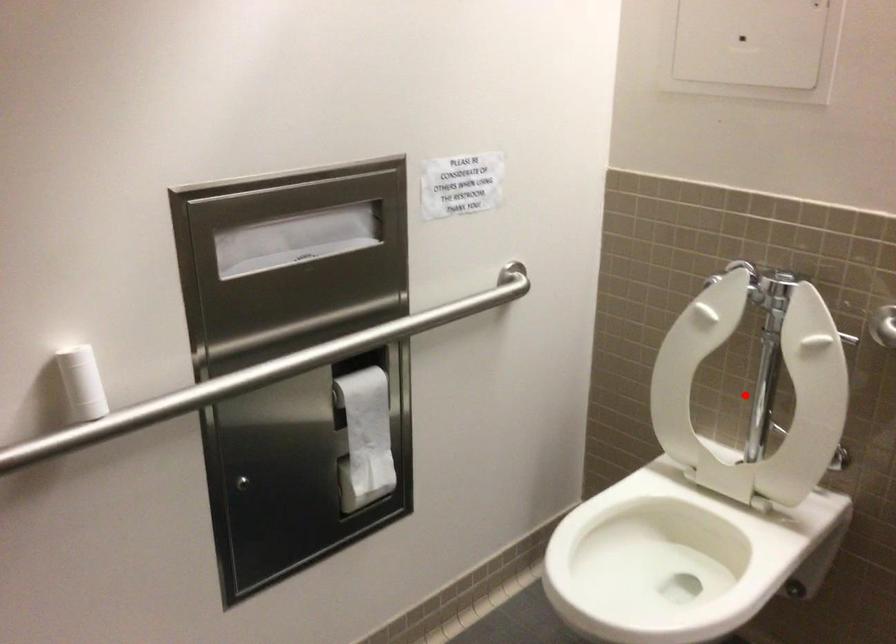
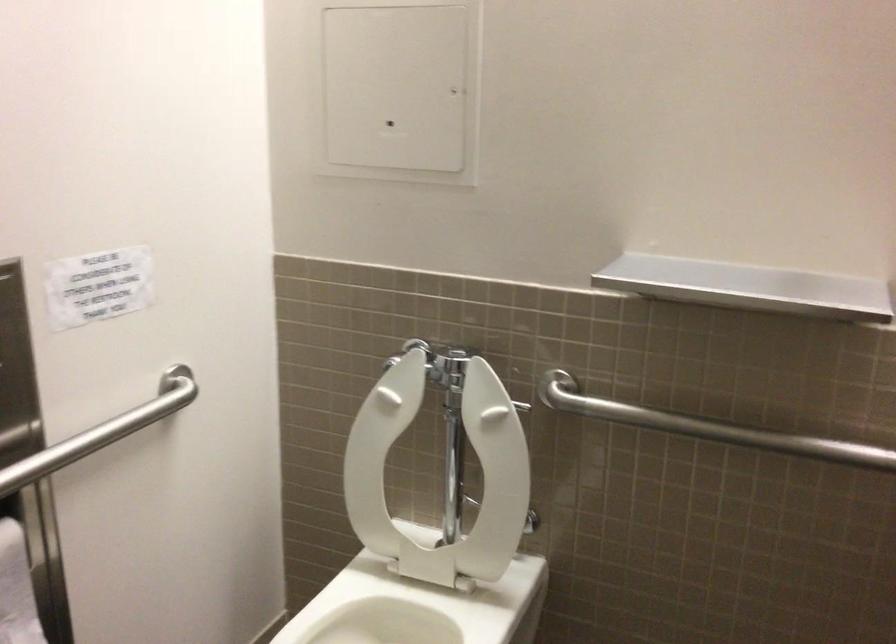
Where in the second image is the point corresponding to the highlighted location from the first image?

(440, 474)